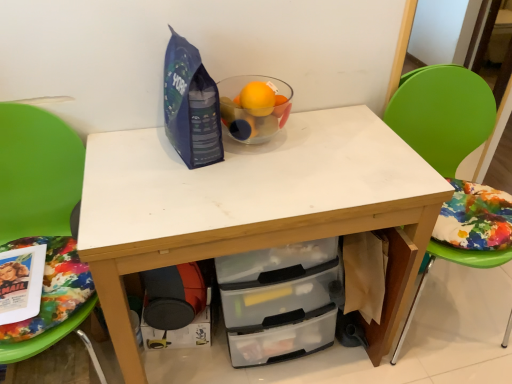
Question: Could black plastic drawer at lower center be considered to be inside transparent glass bowl at center?

Choices:
 (A) no
 (B) yes

Answer: (A)

Question: Is transparent glass bowl at center to the right of black plastic drawer at lower center from the viewer's perspective?

Choices:
 (A) no
 (B) yes

Answer: (B)

Question: Is transparent glass bowl at center wider than black plastic drawer at lower center?

Choices:
 (A) yes
 (B) no

Answer: (A)

Question: From a real-world perspective, does transparent glass bowl at center stand above black plastic drawer at lower center?

Choices:
 (A) no
 (B) yes

Answer: (B)

Question: Is transparent glass bowl at center located outside black plastic drawer at lower center?

Choices:
 (A) yes
 (B) no

Answer: (A)

Question: From the image's perspective, is transparent glass bowl at center above or below green plastic chair at right, marked as the first chair in a right-to-left arrangement?

Choices:
 (A) below
 (B) above

Answer: (B)

Question: Is point (266, 86) positioned closer to the camera than point (453, 76)?

Choices:
 (A) farther
 (B) closer

Answer: (B)

Question: Which is correct: transparent glass bowl at center is inside green plastic chair at right, marked as the first chair in a right-to-left arrangement, or outside of it?

Choices:
 (A) outside
 (B) inside

Answer: (A)

Question: Visually, is transparent glass bowl at center positioned to the left or to the right of green plastic chair at right, marked as the first chair in a right-to-left arrangement?

Choices:
 (A) left
 (B) right

Answer: (A)

Question: From the image's perspective, relative to black plastic drawer at lower center, is green plastic chair at right, marked as the first chair in a right-to-left arrangement, above or below?

Choices:
 (A) below
 (B) above

Answer: (B)

Question: From their relative heights in the image, would you say green plastic chair at right, marked as the first chair in a right-to-left arrangement, is taller or shorter than black plastic drawer at lower center?

Choices:
 (A) short
 (B) tall

Answer: (B)

Question: Looking at the image, does green plastic chair at right, the 2th chair from the left, seem bigger or smaller compared to black plastic drawer at lower center?

Choices:
 (A) big
 (B) small

Answer: (A)

Question: From a real-world perspective, is green plastic chair at right, marked as the first chair in a right-to-left arrangement, positioned above or below black plastic drawer at lower center?

Choices:
 (A) above
 (B) below

Answer: (A)

Question: From the image's perspective, is transparent glass bowl at center located above or below green fabric chair at left, the first chair in the left-to-right sequence?

Choices:
 (A) above
 (B) below

Answer: (A)

Question: Is transparent glass bowl at center in front of or behind green fabric chair at left, the first chair in the left-to-right sequence, in the image?

Choices:
 (A) front
 (B) behind

Answer: (B)